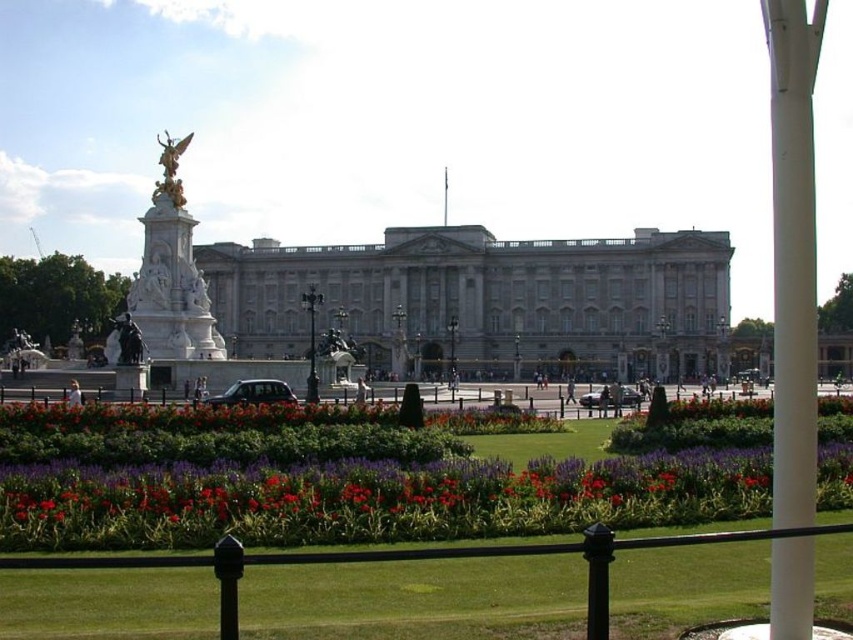
Question: Which is farther from the white marble statue at upper left?

Choices:
 (A) black metal fence at lower center
 (B) stone/brick palace at center
 (C) gold polished statue at upper left

Answer: (B)

Question: Does gold polished statue at upper left have a lesser width compared to polished bronze statue at left?

Choices:
 (A) yes
 (B) no

Answer: (A)

Question: Which of the following is the closest to the observer?

Choices:
 (A) gold polished statue at upper left
 (B) white marble statue at upper left
 (C) stone/brick palace at center

Answer: (B)

Question: Can you confirm if black metal fence at lower center is positioned above white marble statue at upper left?

Choices:
 (A) yes
 (B) no

Answer: (B)

Question: Can you confirm if white marble statue at upper left is smaller than gold polished statue at upper left?

Choices:
 (A) no
 (B) yes

Answer: (A)

Question: Which of the following is the closest to the observer?

Choices:
 (A) (3, 556)
 (B) (405, 368)
 (C) (167, 141)
 (D) (115, 356)

Answer: (A)